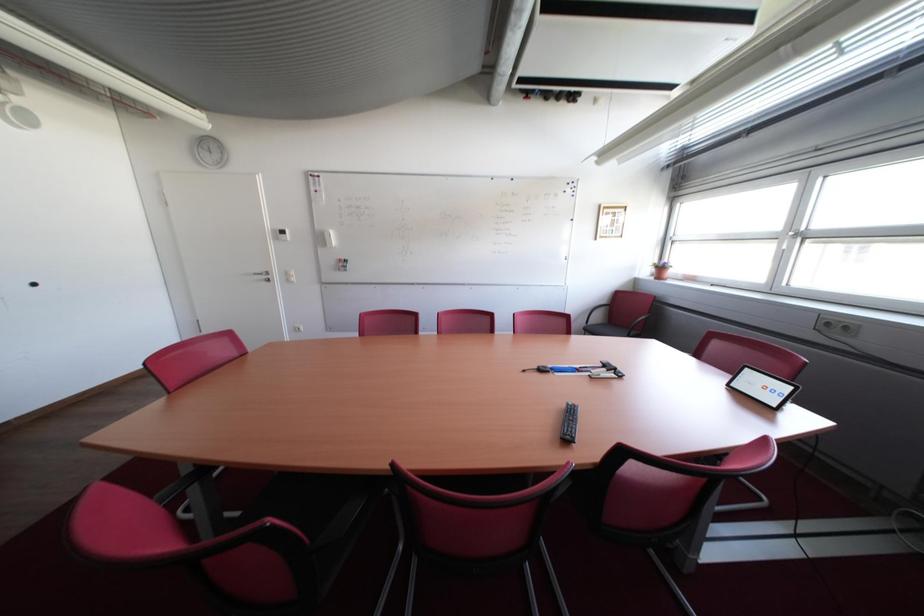
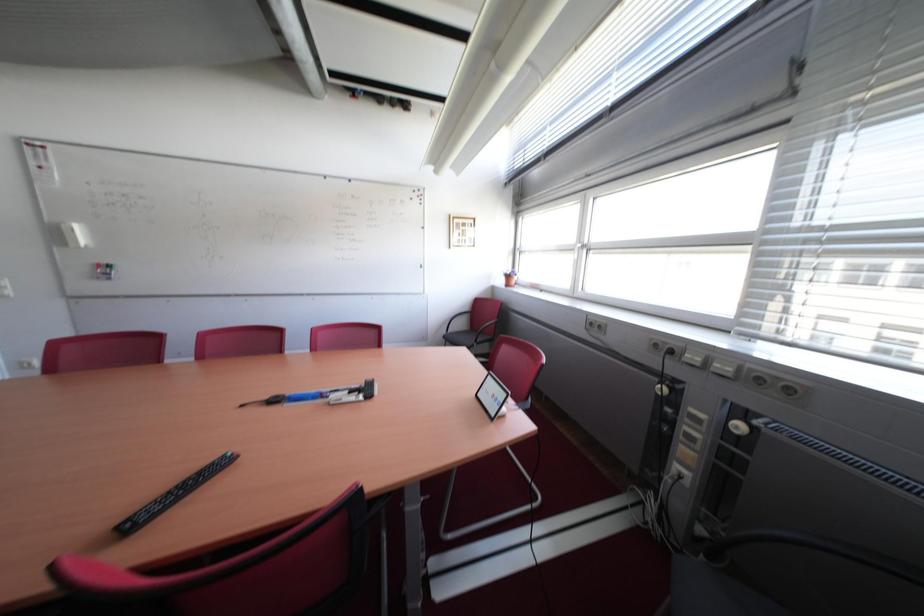
Question: The camera is either moving clockwise (left) or counter-clockwise (right) around the object. The first image is from the beginning of the video and the second image is from the end. Is the camera moving left or right when shooting the video?

Choices:
 (A) Left
 (B) Right

Answer: (A)